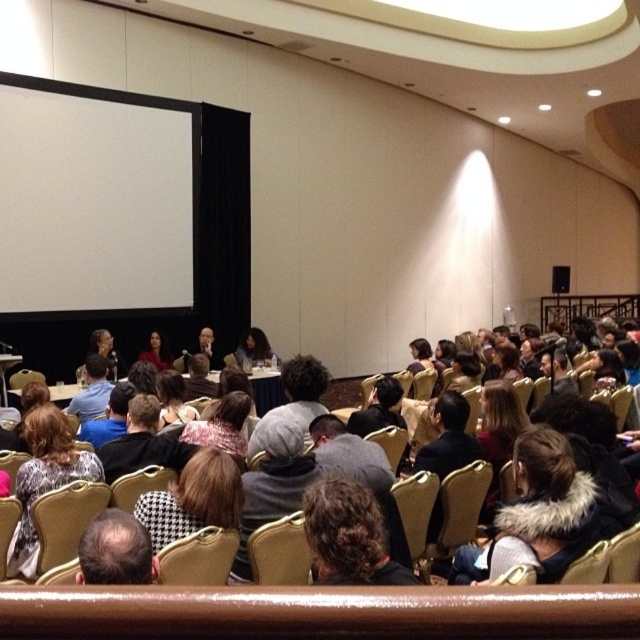
Measure the distance between printed fabric coat at lower left and matte black laptop at center.

printed fabric coat at lower left is 14.38 feet from matte black laptop at center.

Can you confirm if printed fabric coat at lower left is positioned to the right of matte black laptop at center?

In fact, printed fabric coat at lower left is to the left of matte black laptop at center.

Does point (36, 417) come farther from viewer compared to point (262, 342)?

No, it is in front of (262, 342).

Image resolution: width=640 pixels, height=640 pixels. Identify the location of printed fabric coat at lower left. (44, 477).

Does dark curly hair at center appear on the left side of matte black jacket at center?

Incorrect, dark curly hair at center is not on the left side of matte black jacket at center.

Between point (404, 573) and point (161, 360), which one is positioned in front?

Point (404, 573)

Between point (348, 577) and point (170, 365), which one is positioned in front?

Positioned in front is point (348, 577).

Locate an element on the screen. Image resolution: width=640 pixels, height=640 pixels. dark curly hair at center is located at coordinates (348, 536).

Between printed fabric coat at lower left and leather at center, which one is positioned higher?

printed fabric coat at lower left

Can you confirm if printed fabric coat at lower left is positioned above leather at center?

Indeed, printed fabric coat at lower left is positioned over leather at center.

Image resolution: width=640 pixels, height=640 pixels. Describe the element at coordinates (44, 477) in the screenshot. I see `printed fabric coat at lower left` at that location.

Image resolution: width=640 pixels, height=640 pixels. Identify the location of printed fabric coat at lower left. (44, 477).